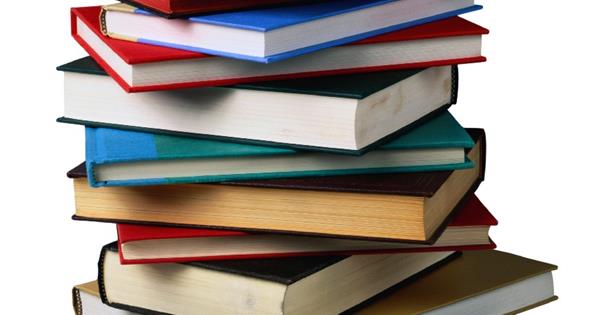
Identify the location of books. This screenshot has width=600, height=315. (412, 302), (311, 287), (201, 242), (310, 205), (176, 163), (292, 113), (169, 77), (244, 30), (182, 6).